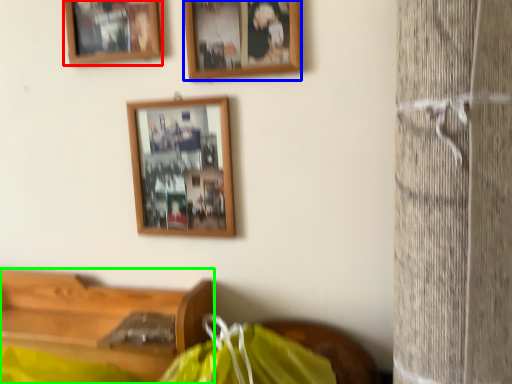
Question: Which object is positioned farthest from picture frame (highlighted by a red box)? Select from picture frame (highlighted by a blue box) and furniture (highlighted by a green box).

Choices:
 (A) picture frame
 (B) furniture

Answer: (B)